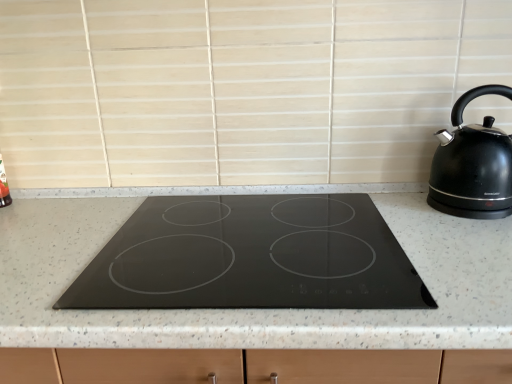
Image resolution: width=512 pixels, height=384 pixels. Identify the location of unoccupied area in front of black glossy kettle at right. (475, 235).